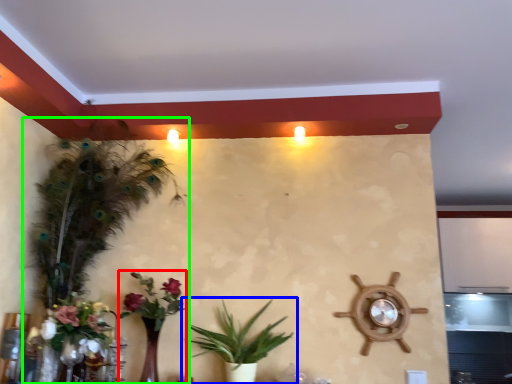
Question: Estimate the real-world distances between objects in this image. Which object is closer to floral arrangement (highlighted by a red box), houseplant (highlighted by a blue box) or houseplant (highlighted by a green box)?

Choices:
 (A) houseplant
 (B) houseplant

Answer: (A)